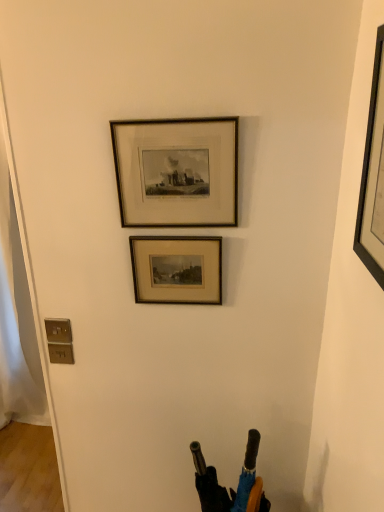
Image resolution: width=384 pixels, height=512 pixels. Describe the element at coordinates (372, 173) in the screenshot. I see `black matte picture frame at upper right, which appears as the 1th picture frame when viewed from the front` at that location.

At what (x,y) coordinates should I click in order to perform the action: click on black matte picture frame at upper right, which appears as the 1th picture frame when viewed from the front. Please return your answer as a coordinate pair (x, y). This screenshot has width=384, height=512. Looking at the image, I should click on (372, 173).

Can you tell me how much wooden framed print at center, positioned as the 3th picture frame in front-to-back order, and black matte picture frame at upper right, the 3th picture frame when ordered from back to front, differ in facing direction?

wooden framed print at center, positioned as the 3th picture frame in front-to-back order, and black matte picture frame at upper right, the 3th picture frame when ordered from back to front, are facing 92 degrees away from each other.

Considering the sizes of wooden framed print at center, the first picture frame when ordered from back to front, and black matte picture frame at upper right, which appears as the 1th picture frame when viewed from the front, in the image, is wooden framed print at center, the first picture frame when ordered from back to front, wider or thinner than black matte picture frame at upper right, which appears as the 1th picture frame when viewed from the front,?

In the image, wooden framed print at center, the first picture frame when ordered from back to front, appears to be more narrow than black matte picture frame at upper right, which appears as the 1th picture frame when viewed from the front.

In the image, is wooden framed print at center, positioned as the 3th picture frame in front-to-back order, on the left side or the right side of black matte picture frame at upper right, the 3th picture frame when ordered from back to front?

In the image, wooden framed print at center, positioned as the 3th picture frame in front-to-back order, appears on the left side of black matte picture frame at upper right, the 3th picture frame when ordered from back to front.

In order to click on picture frame that is the 2nd one when counting rightward from the wooden framed print at center, the first picture frame when ordered from back to front in this screenshot , I will do `click(372, 173)`.

Consider the image. Is black matte picture frame at upper right, the 3th picture frame when ordered from back to front, bigger or smaller than wooden frame at upper center, marked as the 2th picture frame in a back-to-front arrangement?

Considering their sizes, black matte picture frame at upper right, the 3th picture frame when ordered from back to front, takes up more space than wooden frame at upper center, marked as the 2th picture frame in a back-to-front arrangement.

Between point (379, 48) and point (145, 179), which one is positioned in front?

The point (379, 48) is more forward.

Is black matte picture frame at upper right, the 3th picture frame when ordered from back to front, not inside wooden frame at upper center, marked as the 2th picture frame in a back-to-front arrangement?

Absolutely, black matte picture frame at upper right, the 3th picture frame when ordered from back to front, is external to wooden frame at upper center, marked as the 2th picture frame in a back-to-front arrangement.

How far apart are black matte picture frame at upper right, the 3th picture frame when ordered from back to front, and wooden frame at upper center, the second picture frame from the front?

A distance of 18.93 inches exists between black matte picture frame at upper right, the 3th picture frame when ordered from back to front, and wooden frame at upper center, the second picture frame from the front.

Does wooden frame at upper center, the second picture frame from the front, touch black matte picture frame at upper right, which appears as the 1th picture frame when viewed from the front?

No, wooden frame at upper center, the second picture frame from the front, is not making contact with black matte picture frame at upper right, which appears as the 1th picture frame when viewed from the front.

Does wooden frame at upper center, the second picture frame from the front, turn towards black matte picture frame at upper right, the 3th picture frame when ordered from back to front?

No, wooden frame at upper center, the second picture frame from the front, is not oriented towards black matte picture frame at upper right, the 3th picture frame when ordered from back to front.

Does wooden frame at upper center, the second picture frame from the front, have a greater height compared to black matte picture frame at upper right, the 3th picture frame when ordered from back to front?

No, wooden frame at upper center, the second picture frame from the front, is not taller than black matte picture frame at upper right, the 3th picture frame when ordered from back to front.

Does wooden frame at upper center, marked as the 2th picture frame in a back-to-front arrangement, have a lesser width compared to black matte picture frame at upper right, the 3th picture frame when ordered from back to front?

Yes.

Which of these two, black matte picture frame at upper right, the 3th picture frame when ordered from back to front, or wooden framed print at center, the first picture frame when ordered from back to front, is bigger?

black matte picture frame at upper right, the 3th picture frame when ordered from back to front.

Is black matte picture frame at upper right, which appears as the 1th picture frame when viewed from the front, not within wooden framed print at center, the first picture frame when ordered from back to front?

That's correct, black matte picture frame at upper right, which appears as the 1th picture frame when viewed from the front, is outside of wooden framed print at center, the first picture frame when ordered from back to front.

Which object is positioned more to the left, black matte picture frame at upper right, the 3th picture frame when ordered from back to front, or wooden framed print at center, positioned as the 3th picture frame in front-to-back order?

Positioned to the left is wooden framed print at center, positioned as the 3th picture frame in front-to-back order.

Can you confirm if wooden framed print at center, positioned as the 3th picture frame in front-to-back order, is bigger than wooden frame at upper center, the second picture frame from the front?

No.

From the image's perspective, who appears lower, wooden framed print at center, the first picture frame when ordered from back to front, or wooden frame at upper center, the second picture frame from the front?

wooden framed print at center, the first picture frame when ordered from back to front.

Does wooden framed print at center, the first picture frame when ordered from back to front, appear on the left side of wooden frame at upper center, marked as the 2th picture frame in a back-to-front arrangement?

Correct, you'll find wooden framed print at center, the first picture frame when ordered from back to front, to the left of wooden frame at upper center, marked as the 2th picture frame in a back-to-front arrangement.

Which is correct: wooden framed print at center, positioned as the 3th picture frame in front-to-back order, is inside wooden frame at upper center, the second picture frame from the front, or outside of it?

wooden framed print at center, positioned as the 3th picture frame in front-to-back order, is spatially situated outside wooden frame at upper center, the second picture frame from the front.

From the image's perspective, would you say wooden frame at upper center, marked as the 2th picture frame in a back-to-front arrangement, is positioned over wooden framed print at center, positioned as the 3th picture frame in front-to-back order?

Yes.

Considering their positions, is wooden frame at upper center, the second picture frame from the front, located in front of or behind wooden framed print at center, the first picture frame when ordered from back to front?

Clearly, wooden frame at upper center, the second picture frame from the front, is in front of wooden framed print at center, the first picture frame when ordered from back to front.

Measure the distance from wooden frame at upper center, marked as the 2th picture frame in a back-to-front arrangement, to wooden framed print at center, the first picture frame when ordered from back to front.

The distance of wooden frame at upper center, marked as the 2th picture frame in a back-to-front arrangement, from wooden framed print at center, the first picture frame when ordered from back to front, is 17.46 centimeters.

Considering the relative sizes of wooden frame at upper center, marked as the 2th picture frame in a back-to-front arrangement, and wooden framed print at center, the first picture frame when ordered from back to front, in the image provided, is wooden frame at upper center, marked as the 2th picture frame in a back-to-front arrangement, wider than wooden framed print at center, the first picture frame when ordered from back to front,?

No.

At what (x,y) coordinates should I click in order to perform the action: click on the 2nd picture frame to the right when counting from the wooden framed print at center, positioned as the 3th picture frame in front-to-back order. Please return your answer as a coordinate pair (x, y). The width and height of the screenshot is (384, 512). Looking at the image, I should click on coord(372,173).

Which picture frame is the 1st one when counting from the back of the black matte picture frame at upper right, which appears as the 1th picture frame when viewed from the front? Please provide its 2D coordinates.

[(177, 172)]

Estimate the real-world distances between objects in this image. Which object is further from wooden frame at upper center, marked as the 2th picture frame in a back-to-front arrangement, black matte picture frame at upper right, which appears as the 1th picture frame when viewed from the front, or wooden framed print at center, positioned as the 3th picture frame in front-to-back order?

black matte picture frame at upper right, which appears as the 1th picture frame when viewed from the front.

When comparing their distances from wooden frame at upper center, marked as the 2th picture frame in a back-to-front arrangement, does wooden framed print at center, positioned as the 3th picture frame in front-to-back order, or black matte picture frame at upper right, the 3th picture frame when ordered from back to front, seem closer?

Among the two, wooden framed print at center, positioned as the 3th picture frame in front-to-back order, is located nearer to wooden frame at upper center, marked as the 2th picture frame in a back-to-front arrangement.

Considering their positions, is wooden framed print at center, positioned as the 3th picture frame in front-to-back order, positioned closer to black matte picture frame at upper right, which appears as the 1th picture frame when viewed from the front, than wooden frame at upper center, marked as the 2th picture frame in a back-to-front arrangement?

wooden frame at upper center, marked as the 2th picture frame in a back-to-front arrangement, lies closer to black matte picture frame at upper right, which appears as the 1th picture frame when viewed from the front, than the other object.

When comparing their distances from wooden framed print at center, the first picture frame when ordered from back to front, does wooden frame at upper center, marked as the 2th picture frame in a back-to-front arrangement, or black matte picture frame at upper right, which appears as the 1th picture frame when viewed from the front, seem closer?

The object closer to wooden framed print at center, the first picture frame when ordered from back to front, is wooden frame at upper center, marked as the 2th picture frame in a back-to-front arrangement.

Estimate the real-world distances between objects in this image. Which object is closer to black matte picture frame at upper right, which appears as the 1th picture frame when viewed from the front, wooden frame at upper center, the second picture frame from the front, or wooden framed print at center, positioned as the 3th picture frame in front-to-back order?

wooden frame at upper center, the second picture frame from the front, is positioned closer to the anchor black matte picture frame at upper right, which appears as the 1th picture frame when viewed from the front.

When comparing their distances from wooden framed print at center, the first picture frame when ordered from back to front, does black matte picture frame at upper right, the 3th picture frame when ordered from back to front, or wooden frame at upper center, the second picture frame from the front, seem closer?

Based on the image, wooden frame at upper center, the second picture frame from the front, appears to be nearer to wooden framed print at center, the first picture frame when ordered from back to front.

Where is `picture frame between black matte picture frame at upper right, which appears as the 1th picture frame when viewed from the front, and wooden framed print at center, the first picture frame when ordered from back to front, from front to back`? picture frame between black matte picture frame at upper right, which appears as the 1th picture frame when viewed from the front, and wooden framed print at center, the first picture frame when ordered from back to front, from front to back is located at coordinates (177, 172).